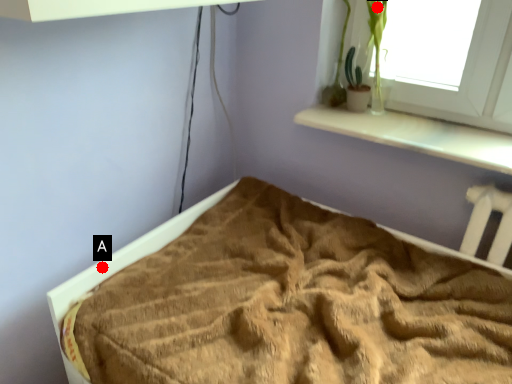
Question: Two points are circled on the image, labeled by A and B beside each circle. Which of the following is the farthest from the observer?

Choices:
 (A) A is further
 (B) B is further

Answer: (B)